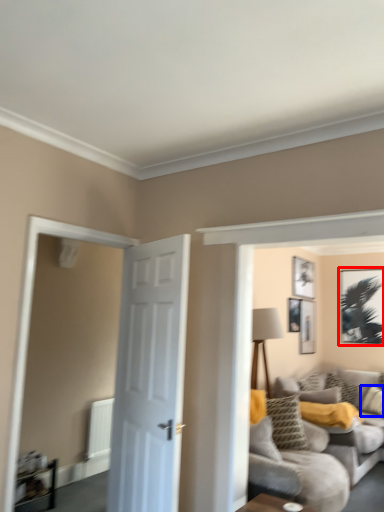
Question: Among these objects, which one is farthest to the camera, picture frame (highlighted by a red box) or pillow (highlighted by a blue box)?

Choices:
 (A) picture frame
 (B) pillow

Answer: (A)